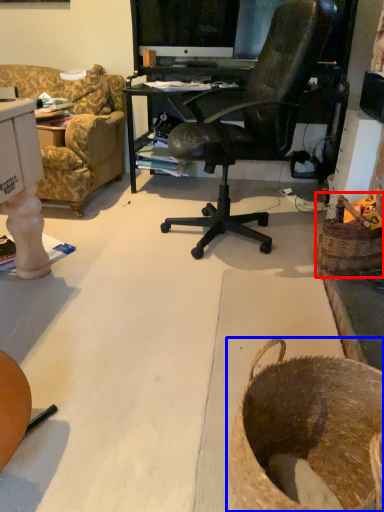
Question: Which object appears closest to the camera in this image, basket (highlighted by a red box) or basket (highlighted by a blue box)?

Choices:
 (A) basket
 (B) basket

Answer: (B)